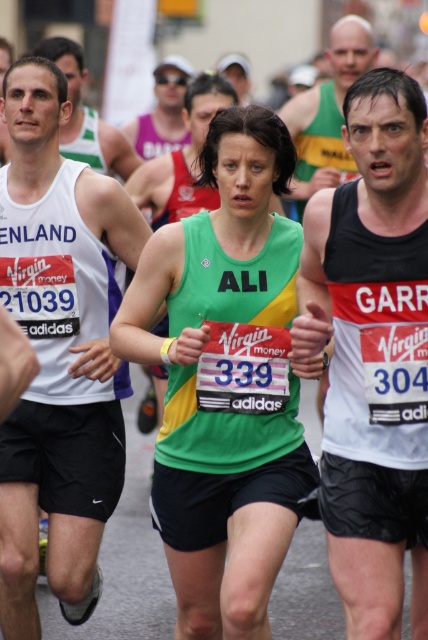
Question: Which point is closer to the camera?

Choices:
 (A) (267, 564)
 (B) (154, 138)

Answer: (A)

Question: Which point is farther to the camera?

Choices:
 (A) (180, 106)
 (B) (333, 45)

Answer: (A)

Question: Can you confirm if green jersey at center is smaller than white tank top at center?

Choices:
 (A) no
 (B) yes

Answer: (B)

Question: Is green/yellow fabric tank top at center to the right of white matte tank top at left from the viewer's perspective?

Choices:
 (A) no
 (B) yes

Answer: (B)

Question: Is black matte tank top at center positioned before green jersey at center?

Choices:
 (A) yes
 (B) no

Answer: (A)

Question: Which point is closer to the camera?

Choices:
 (A) (341, 204)
 (B) (80, 129)
 (C) (169, 136)

Answer: (A)